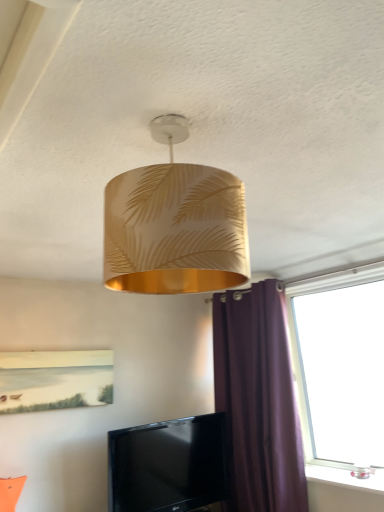
Question: Does transparent glass window at right appear on the right side of black glossy tv at lower center?

Choices:
 (A) yes
 (B) no

Answer: (A)

Question: Considering the relative sizes of transparent glass window at right and black glossy tv at lower center in the image provided, is transparent glass window at right smaller than black glossy tv at lower center?

Choices:
 (A) yes
 (B) no

Answer: (B)

Question: Is black glossy tv at lower center completely or partially inside transparent glass window at right?

Choices:
 (A) yes
 (B) no

Answer: (B)

Question: Could you tell me if transparent glass window at right is facing black glossy tv at lower center?

Choices:
 (A) yes
 (B) no

Answer: (B)

Question: Does transparent glass window at right come behind black glossy tv at lower center?

Choices:
 (A) yes
 (B) no

Answer: (B)

Question: From a real-world perspective, is black glossy tv at lower center above or below purple fabric curtain at right?

Choices:
 (A) below
 (B) above

Answer: (A)

Question: Relative to purple fabric curtain at right, is black glossy tv at lower center in front or behind?

Choices:
 (A) front
 (B) behind

Answer: (B)

Question: From the image's perspective, relative to purple fabric curtain at right, is black glossy tv at lower center above or below?

Choices:
 (A) below
 (B) above

Answer: (A)

Question: In terms of height, does black glossy tv at lower center look taller or shorter compared to purple fabric curtain at right?

Choices:
 (A) tall
 (B) short

Answer: (B)

Question: Which is correct: black glossy tv at lower center is inside transparent glass window at right, or outside of it?

Choices:
 (A) inside
 (B) outside

Answer: (B)

Question: From their relative heights in the image, would you say black glossy tv at lower center is taller or shorter than transparent glass window at right?

Choices:
 (A) short
 (B) tall

Answer: (A)

Question: Is black glossy tv at lower center bigger or smaller than transparent glass window at right?

Choices:
 (A) big
 (B) small

Answer: (B)

Question: In the image, is black glossy tv at lower center positioned in front of or behind transparent glass window at right?

Choices:
 (A) front
 (B) behind

Answer: (B)

Question: In the image, is transparent glass window at right positioned in front of or behind black glossy tv at lower center?

Choices:
 (A) front
 (B) behind

Answer: (A)

Question: Is transparent glass window at right taller or shorter than black glossy tv at lower center?

Choices:
 (A) tall
 (B) short

Answer: (A)